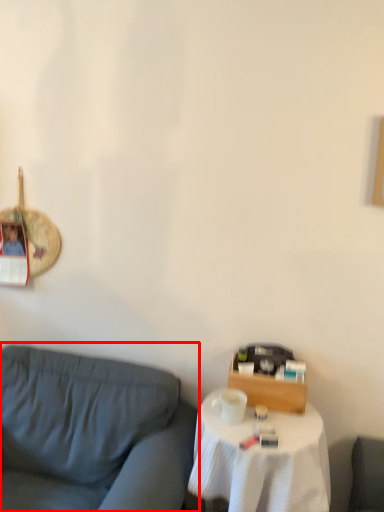
Question: From the image's perspective, where is studio couch (annotated by the red box) located relative to table?

Choices:
 (A) below
 (B) above

Answer: (B)